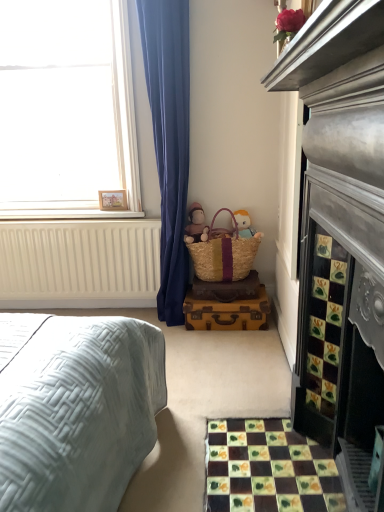
You are a GUI agent. You are given a task and a screenshot of the screen. Output one action in this format:
    pyautogui.click(x=<x>, y=<y>)
    Task: Click on the vacant space to the left of wooden frame at upper left
    
    Given the screenshot: What is the action you would take?
    pyautogui.click(x=85, y=210)